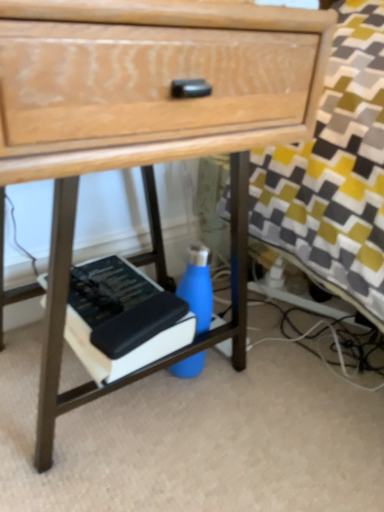
The width and height of the screenshot is (384, 512). In order to click on vacant region in front of blue matte water bottle at center in this screenshot , I will do `click(198, 450)`.